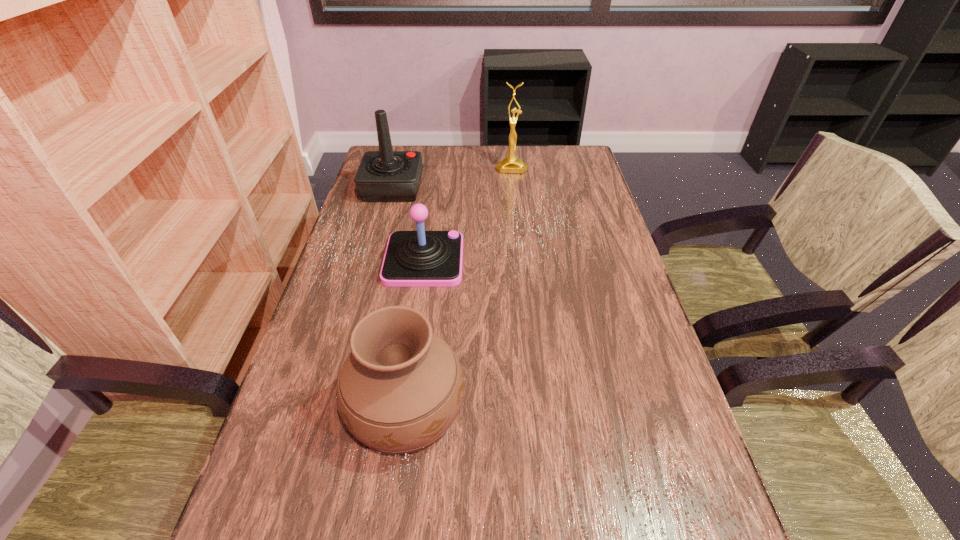
Locate an element on the screen. award is located at coordinates (511, 164).

Find the location of a particular element. The width and height of the screenshot is (960, 540). the farther joystick is located at coordinates (383, 176).

Find the location of `the nearest object`. the nearest object is located at coordinates (400, 389).

The height and width of the screenshot is (540, 960). Find the location of `urn`. urn is located at coordinates (400, 389).

Identify the location of the nearer joystick. The image size is (960, 540). (420, 258).

Find the location of a particular element. The image size is (960, 540). the shorter joystick is located at coordinates (420, 258).

You are a GUI agent. You are given a task and a screenshot of the screen. Output one action in this format:
    pyautogui.click(x=<x>, y=<y>)
    Task: Click on the vacant region located 0.080m on the front-facing side of the award
    Image resolution: width=960 pixels, height=540 pixels.
    Given the screenshot: What is the action you would take?
    pyautogui.click(x=514, y=187)

Find the location of `blank area located 0.120m on the front-facing side of the farther joystick`. blank area located 0.120m on the front-facing side of the farther joystick is located at coordinates (458, 188).

Locate an element on the screen. This screenshot has width=960, height=540. vacant area situated on the back of the urn is located at coordinates pyautogui.click(x=423, y=275).

This screenshot has width=960, height=540. Identify the location of free space located 0.400m forward from the base of the shorter joystick. (612, 260).